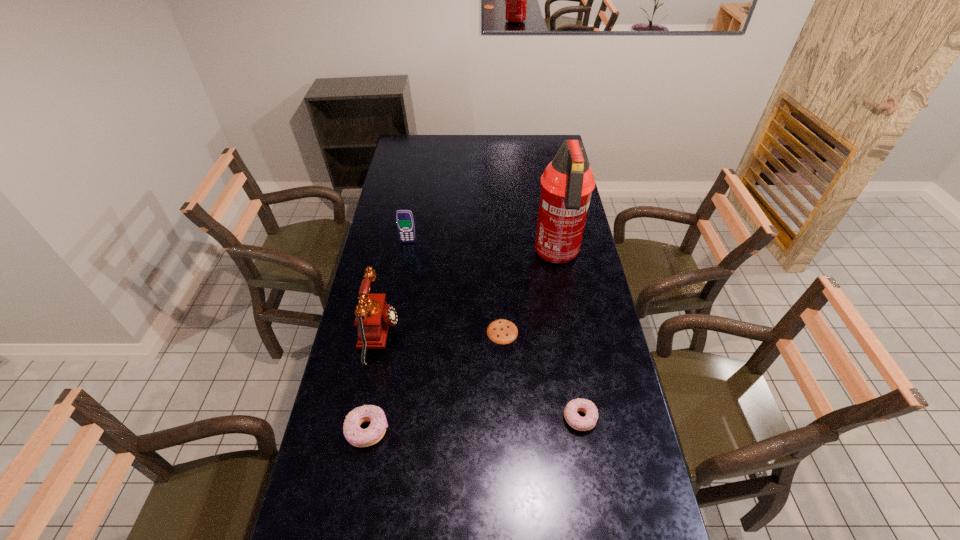
Locate an element on the screen. Image resolution: width=960 pixels, height=540 pixels. the fourth tallest object is located at coordinates (354, 434).

The height and width of the screenshot is (540, 960). I want to click on the taller doughnut, so click(x=354, y=434).

Locate an element on the screen. the shorter doughnut is located at coordinates (586, 423).

At what (x,y) coordinates should I click in order to perform the action: click on the fifth tallest object. Please return your answer as a coordinate pair (x, y). This screenshot has width=960, height=540. Looking at the image, I should click on (586, 423).

This screenshot has height=540, width=960. I want to click on cellular telephone, so click(x=404, y=218).

You are a GUI agent. You are given a task and a screenshot of the screen. Output one action in this format:
    pyautogui.click(x=<x>, y=<y>)
    Task: Click on the fire extinguisher
    This screenshot has width=960, height=540.
    Given the screenshot: What is the action you would take?
    pyautogui.click(x=567, y=183)

Identify the location of the fifth shortest object. (374, 316).

The width and height of the screenshot is (960, 540). Identify the location of cookie. (501, 331).

Find the location of a particular element. Image resolution: width=960 pixels, height=540 pixels. the third object from right to left is located at coordinates (501, 331).

Identify the location of free space located 0.250m on the right of the taller doughnut. (474, 431).